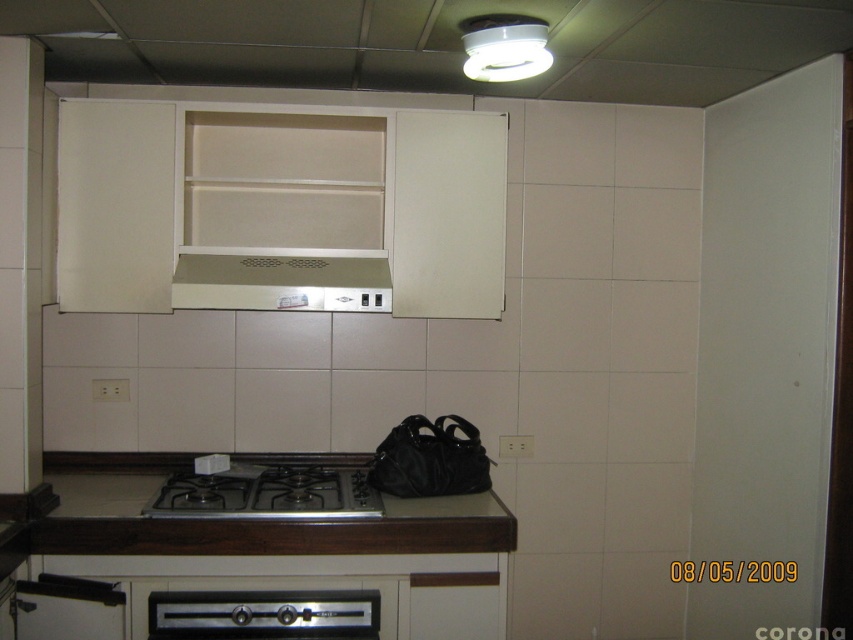
You are standing in the kitchen and want to place a hot pan on the brown wood counter top at center. However, you notice the satin beige exhaust hood at center is above it. Is the counter top within reach of the exhaust hood to help with ventilation?

The brown wood counter top at center is closer to the viewer than the satin beige exhaust hood at center, meaning the exhaust hood is positioned above it. Since exhaust hoods are typically designed to be above cooking surfaces, the counter top is likely within the exhaust hood range for ventilation.

You are a chef preparing to place a hot dish on the brown wood counter top at center. You notice the satin silver oven at lower center nearby. Which surface should you avoid placing the dish directly on to prevent damage?

You should avoid placing the dish directly on the satin silver oven at lower center because the brown wood counter top at center is in front of it, meaning the oven surface is likely hotter and could damage the dish.